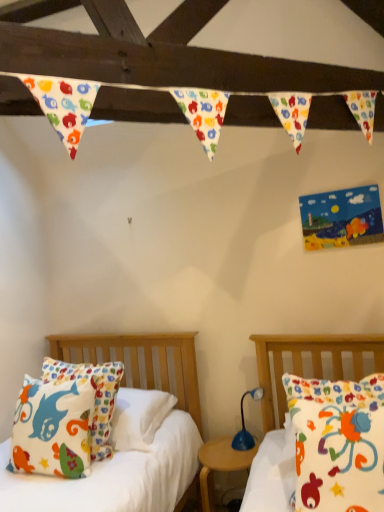
Describe the element at coordinates (148, 375) in the screenshot. I see `matte cotton pillow at left, placed as the 2th bed when sorted from front to back` at that location.

The height and width of the screenshot is (512, 384). I want to click on matte cotton pillow at left, which ranks as the 1th bed in left-to-right order, so click(148, 375).

Which of these two, blue plastic lamp at center or matte cotton pillow at left, acting as the first bed starting from the back, is bigger?

matte cotton pillow at left, acting as the first bed starting from the back, is bigger.

Considering the sizes of blue plastic lamp at center and matte cotton pillow at left, acting as the first bed starting from the back, in the image, is blue plastic lamp at center taller or shorter than matte cotton pillow at left, acting as the first bed starting from the back,?

Considering their sizes, blue plastic lamp at center has less height than matte cotton pillow at left, acting as the first bed starting from the back.

From a real-world perspective, between blue plastic lamp at center and matte cotton pillow at left, placed as the 2th bed when sorted from front to back, who is vertically lower?

blue plastic lamp at center.

Which is more to the left, wooden nightstand at center or matte cotton pillow at left, placed as the 2th bed when sorted from front to back?

From the viewer's perspective, matte cotton pillow at left, placed as the 2th bed when sorted from front to back, appears more on the left side.

Considering the relative sizes of wooden nightstand at center and matte cotton pillow at left, which ranks as the 1th bed in left-to-right order, in the image provided, is wooden nightstand at center wider than matte cotton pillow at left, which ranks as the 1th bed in left-to-right order,?

Yes.

In the image, there is a matte cotton pillow at left, which ranks as the 2th bed in right-to-left order. Where is `nightstand below it (from a real-world perspective)`? The image size is (384, 512). nightstand below it (from a real-world perspective) is located at coordinates (220, 464).

This screenshot has width=384, height=512. Identify the location of the 2nd bed counting from the right side of the matte cotton pillow at left. (312, 362).

Which of these two, matte cotton pillow at right, placed as the 1th bed when sorted from right to left, or matte cotton pillow at left, is wider?

matte cotton pillow at right, placed as the 1th bed when sorted from right to left, is wider.

Looking at this image, from the image's perspective, between matte cotton pillow at right, positioned as the 2th bed in back-to-front order, and matte cotton pillow at left, which one is located above?

matte cotton pillow at right, positioned as the 2th bed in back-to-front order, is shown above in the image.

Does matte cotton pillow at right, arranged as the 2th bed when viewed from the left, touch matte cotton pillow at left?

No, matte cotton pillow at right, arranged as the 2th bed when viewed from the left, is not with matte cotton pillow at left.

Is matte cotton pillow at right, the first bed in the front-to-back sequence, further to the viewer compared to wooden nightstand at center?

That is False.

This screenshot has width=384, height=512. I want to click on the 2nd bed in front when counting from the wooden nightstand at center, so click(x=312, y=362).

Which is farther, (278, 395) or (230, 442)?

Point (230, 442)

Is matte cotton pillow at right, the first bed in the front-to-back sequence, bigger than wooden nightstand at center?

Indeed, matte cotton pillow at right, the first bed in the front-to-back sequence, has a larger size compared to wooden nightstand at center.

Can you confirm if matte cotton pillow at right, placed as the 1th bed when sorted from right to left, is positioned to the left of matte cotton pillow at left, placed as the 2th bed when sorted from front to back?

Incorrect, matte cotton pillow at right, placed as the 1th bed when sorted from right to left, is not on the left side of matte cotton pillow at left, placed as the 2th bed when sorted from front to back.

In terms of size, does matte cotton pillow at right, the first bed in the front-to-back sequence, appear bigger or smaller than matte cotton pillow at left, acting as the first bed starting from the back?

Clearly, matte cotton pillow at right, the first bed in the front-to-back sequence, is larger in size than matte cotton pillow at left, acting as the first bed starting from the back.

From the image's perspective, relative to matte cotton pillow at left, placed as the 2th bed when sorted from front to back, is matte cotton pillow at right, arranged as the 2th bed when viewed from the left, above or below?

Based on their image positions, matte cotton pillow at right, arranged as the 2th bed when viewed from the left, is located above matte cotton pillow at left, placed as the 2th bed when sorted from front to back.

Which object is thinner, matte cotton pillow at right, positioned as the 2th bed in back-to-front order, or matte cotton pillow at left, placed as the 2th bed when sorted from front to back?

With smaller width is matte cotton pillow at left, placed as the 2th bed when sorted from front to back.

Can we say blue plastic lamp at center lies outside matte cotton pillow at right, arranged as the 2th bed when viewed from the left?

Absolutely, blue plastic lamp at center is external to matte cotton pillow at right, arranged as the 2th bed when viewed from the left.

From a real-world perspective, between blue plastic lamp at center and matte cotton pillow at right, positioned as the 2th bed in back-to-front order, who is vertically higher?

From a 3D spatial view, matte cotton pillow at right, positioned as the 2th bed in back-to-front order, is above.

Does blue plastic lamp at center lie behind matte cotton pillow at right, the first bed in the front-to-back sequence?

Yes, the depth of blue plastic lamp at center is greater than that of matte cotton pillow at right, the first bed in the front-to-back sequence.

Considering the points (243, 414) and (59, 444), which point is behind, point (243, 414) or point (59, 444)?

The point (243, 414) is farther from the camera.

How many degrees apart are the facing directions of blue plastic lamp at center and matte cotton pillow at left?

They differ by 40.1 degrees in their facing directions.

Does blue plastic lamp at center have a lesser width compared to matte cotton pillow at left?

Yes.

Does blue plastic lamp at center lie in front of matte cotton pillow at left?

No, it is behind matte cotton pillow at left.

Identify the location of bed on the left of blue plastic lamp at center. The height and width of the screenshot is (512, 384). (148, 375).

From the image's perspective, count 1st beds upward from the wooden nightstand at center and point to it. Please provide its 2D coordinates.

[(148, 375)]

When comparing their distances from matte cotton pillow at left, does matte cotton pillow at left, acting as the first bed starting from the back, or blue plastic lamp at center seem further?

blue plastic lamp at center lies further to matte cotton pillow at left than the other object.

Considering their positions, is matte cotton pillow at right, positioned as the 2th bed in back-to-front order, positioned further to blue plastic lamp at center than matte cotton pillow at left, acting as the first bed starting from the back?

matte cotton pillow at left, acting as the first bed starting from the back, is positioned further to the anchor blue plastic lamp at center.

Estimate the real-world distances between objects in this image. Which object is further from matte cotton pillow at left, placed as the 2th bed when sorted from front to back, matte cotton pillow at left or wooden nightstand at center?

matte cotton pillow at left is further to matte cotton pillow at left, placed as the 2th bed when sorted from front to back.

Looking at the image, which one is located further to blue plastic lamp at center, matte cotton pillow at left, acting as the first bed starting from the back, or matte cotton pillow at left?

matte cotton pillow at left.

Considering their positions, is matte cotton pillow at right, arranged as the 2th bed when viewed from the left, positioned further to blue plastic lamp at center than matte cotton pillow at left?

matte cotton pillow at left.

When comparing their distances from wooden nightstand at center, does matte cotton pillow at left or matte cotton pillow at right, the first bed in the front-to-back sequence, seem closer?

Among the two, matte cotton pillow at right, the first bed in the front-to-back sequence, is located nearer to wooden nightstand at center.

Which object lies further to the anchor point wooden nightstand at center, matte cotton pillow at right, arranged as the 2th bed when viewed from the left, or matte cotton pillow at left, acting as the first bed starting from the back?

matte cotton pillow at right, arranged as the 2th bed when viewed from the left, lies further to wooden nightstand at center than the other object.

Based on their spatial positions, is matte cotton pillow at right, the first bed in the front-to-back sequence, or wooden nightstand at center further from blue plastic lamp at center?

Based on the image, matte cotton pillow at right, the first bed in the front-to-back sequence, appears to be further to blue plastic lamp at center.

Where is `nightstand between matte cotton pillow at left and matte cotton pillow at right, the first bed in the front-to-back sequence`? Image resolution: width=384 pixels, height=512 pixels. nightstand between matte cotton pillow at left and matte cotton pillow at right, the first bed in the front-to-back sequence is located at coordinates (220, 464).

Locate an element on the screen. Image resolution: width=384 pixels, height=512 pixels. bed between matte cotton pillow at left and wooden nightstand at center from left to right is located at coordinates (148, 375).

Identify the location of bed located between matte cotton pillow at left and matte cotton pillow at right, arranged as the 2th bed when viewed from the left, in the left-right direction. (148, 375).

At what (x,y) coordinates should I click in order to perform the action: click on bed located between matte cotton pillow at left and blue plastic lamp at center in the left-right direction. Please return your answer as a coordinate pair (x, y). The width and height of the screenshot is (384, 512). Looking at the image, I should click on (148, 375).